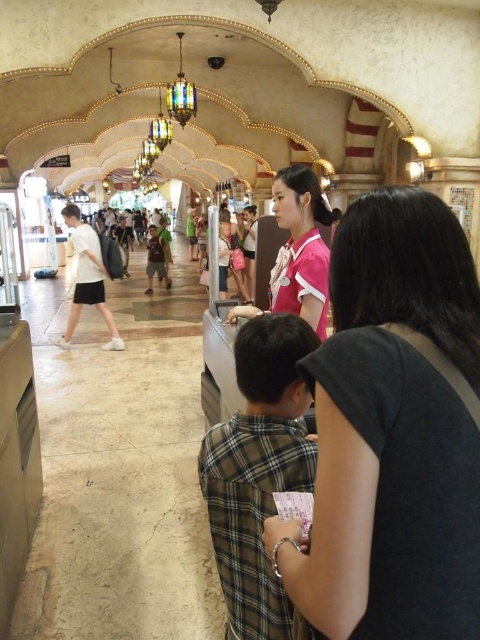
You are standing at the counter and need to hand over a document to someone. The document is placed on the counter between the pink fabric shirt at center and the pink jersey at center. If you want to reach the document quickly, which direction should you move towards?

The pink fabric shirt at center is 3.47 meters away from pink jersey at center. To reach the document quickly, you should move towards whichever object is closer to your current position, but since the exact distance from you to each is not specified, you can estimate based on their positions. However, since both are at center, you might need to check their exact locations relative to you.

You are a photographer positioned in front of the counter. You want to take a photo that includes both the pink fabric shirt at center and the green fabric shirt at center. Which shirt should you focus on to ensure both are in clear view?

You should focus on the pink fabric shirt at center because it is closer to the viewer than the green fabric shirt at center, ensuring both are in clear view.